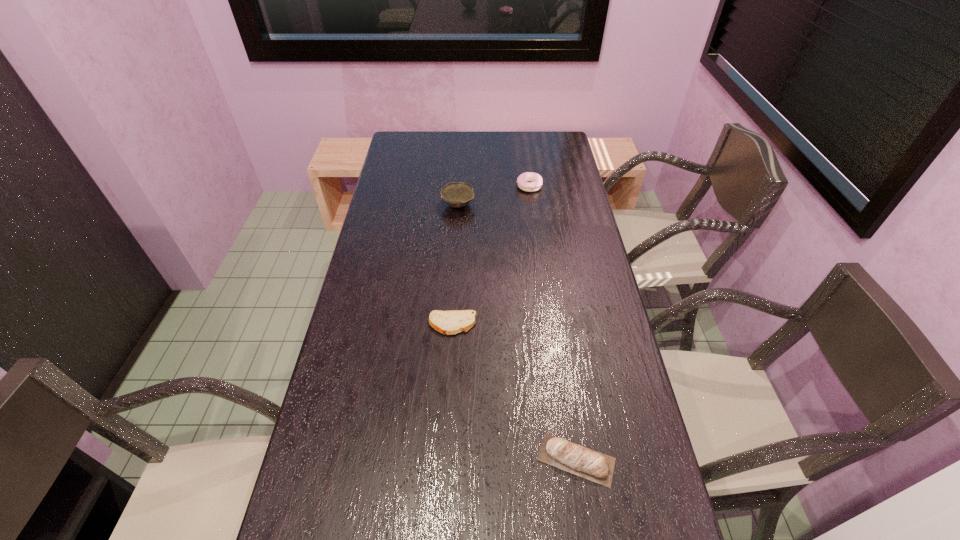
Locate an element on the screen. This screenshot has height=540, width=960. vacant region that satisfies the following two spatial constraints: 1. on the front side of the taller pita bread; 2. on the right side of the shorter pita bread is located at coordinates (445, 460).

Where is `free space in the image that satisfies the following two spatial constraints: 1. on the back side of the farthest object; 2. on the left side of the second farthest object`? Image resolution: width=960 pixels, height=540 pixels. free space in the image that satisfies the following two spatial constraints: 1. on the back side of the farthest object; 2. on the left side of the second farthest object is located at coordinates (459, 186).